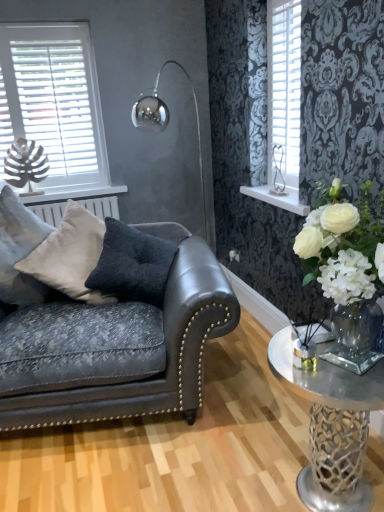
This screenshot has width=384, height=512. I want to click on white silk flower at center, so click(x=234, y=256).

At what (x,y) coordinates should I click in order to perform the action: click on white wood shelf at upper right. Please return your answer as a coordinate pair (x, y). The height and width of the screenshot is (512, 384). Looking at the image, I should click on pyautogui.click(x=278, y=198).

Find the location of `clear glass vase at right`. clear glass vase at right is located at coordinates (331, 426).

This screenshot has width=384, height=512. Describe the element at coordinates (331, 426) in the screenshot. I see `clear glass vase at right` at that location.

Describe the element at coordinates (19, 251) in the screenshot. I see `soft white fabric pillow at upper left, which appears as the 1th pillow when viewed from the left` at that location.

At what (x,y) coordinates should I click in order to perform the action: click on soft white fabric pillow at upper left, which appears as the 1th pillow when viewed from the left. Please return your answer as a coordinate pair (x, y). This screenshot has width=384, height=512. Looking at the image, I should click on (19, 251).

Find the location of `leather couch at left`. leather couch at left is located at coordinates (117, 347).

The image size is (384, 512). Find the location of `white silk flower at center`. white silk flower at center is located at coordinates (234, 256).

Is white wood shelf at upper right touching soft white fabric pillow at upper left, arranged as the third pillow when viewed from the right?

No, white wood shelf at upper right is not beside soft white fabric pillow at upper left, arranged as the third pillow when viewed from the right.

Is white wood shelf at upper right facing away from soft white fabric pillow at upper left, which appears as the 1th pillow when viewed from the left?

No, white wood shelf at upper right is not facing away from soft white fabric pillow at upper left, which appears as the 1th pillow when viewed from the left.

Based on the photo, which point is more distant from viewer, (x=276, y=201) or (x=1, y=291)?

Point (x=276, y=201)

Does white wood shelf at upper right have a greater height compared to soft white fabric pillow at upper left, which appears as the 1th pillow when viewed from the left?

No, white wood shelf at upper right is not taller than soft white fabric pillow at upper left, which appears as the 1th pillow when viewed from the left.

Considering the relative sizes of white plastic blinds at upper left and white wood shelf at upper right in the image provided, is white plastic blinds at upper left taller than white wood shelf at upper right?

Indeed, white plastic blinds at upper left has a greater height compared to white wood shelf at upper right.

Looking at this image, is white wood shelf at upper right at the back of white plastic blinds at upper left?

No.

Can you confirm if white plastic blinds at upper left is positioned to the left of white wood shelf at upper right?

Indeed, white plastic blinds at upper left is positioned on the left side of white wood shelf at upper right.

Between white plastic blinds at upper left and white wood shelf at upper right, which one has larger width?

white wood shelf at upper right.

Is the surface of white plastic blinds at upper left in direct contact with clear glass vase at lower right?

There is a gap between white plastic blinds at upper left and clear glass vase at lower right.

Based on the photo, choose the correct answer: Is white plastic blinds at upper left inside clear glass vase at lower right or outside it?

white plastic blinds at upper left is not inside clear glass vase at lower right, it's outside.

From a real-world perspective, is white plastic blinds at upper left positioned above or below clear glass vase at lower right?

white plastic blinds at upper left is above clear glass vase at lower right.

In the scene shown: Can you confirm if white plastic blinds at upper left is shorter than clear glass vase at lower right?

No.

Is silver metallic heart-shaped ornament at upper right placed right next to dark gray textured cushion at center, which ranks as the 3th pillow in left-to-right order?

No, silver metallic heart-shaped ornament at upper right is not beside dark gray textured cushion at center, which ranks as the 3th pillow in left-to-right order.

Can you confirm if silver metallic heart-shaped ornament at upper right is wider than dark gray textured cushion at center, the first pillow from the right?

In fact, silver metallic heart-shaped ornament at upper right might be narrower than dark gray textured cushion at center, the first pillow from the right.

Which object is positioned more to the left, silver metallic heart-shaped ornament at upper right or dark gray textured cushion at center, the first pillow from the right?

dark gray textured cushion at center, the first pillow from the right.

Is white plastic blinds at upper left taller than silver metallic heart-shaped ornament at upper right?

Correct, white plastic blinds at upper left is much taller as silver metallic heart-shaped ornament at upper right.

Considering the sizes of objects white plastic blinds at upper left and silver metallic heart-shaped ornament at upper right in the image provided, who is smaller, white plastic blinds at upper left or silver metallic heart-shaped ornament at upper right?

With smaller size is silver metallic heart-shaped ornament at upper right.

Is white plastic blinds at upper left outside of silver metallic heart-shaped ornament at upper right?

Yes, white plastic blinds at upper left is located beyond the bounds of silver metallic heart-shaped ornament at upper right.

From a real-world perspective, which object rests below the other?

From a 3D spatial view, silver metallic heart-shaped ornament at upper right is below.

Considering the relative sizes of leather couch at left and dark gray textured cushion at center, which ranks as the 3th pillow in left-to-right order, in the image provided, is leather couch at left shorter than dark gray textured cushion at center, which ranks as the 3th pillow in left-to-right order,?

No.

Is leather couch at left oriented away from dark gray textured cushion at center, the first pillow from the right?

No, leather couch at left is not facing away from dark gray textured cushion at center, the first pillow from the right.

Based on the photo, from the image's perspective, is leather couch at left on dark gray textured cushion at center, which ranks as the 3th pillow in left-to-right order?

No, from the image's perspective, leather couch at left is not over dark gray textured cushion at center, which ranks as the 3th pillow in left-to-right order.

Does leather couch at left have a smaller size compared to dark gray textured cushion at center, the first pillow from the right?

No.

Are clear glass vase at right and white wood shelf at upper right located far from each other?

Absolutely, clear glass vase at right is distant from white wood shelf at upper right.

How many degrees apart are the facing directions of clear glass vase at right and white wood shelf at upper right?

There is a 0.000219-degree angle between the facing directions of clear glass vase at right and white wood shelf at upper right.

Does clear glass vase at right turn towards white wood shelf at upper right?

No, clear glass vase at right is not aimed at white wood shelf at upper right.

Considering the relative sizes of clear glass vase at right and white wood shelf at upper right in the image provided, is clear glass vase at right smaller than white wood shelf at upper right?

No.

This screenshot has width=384, height=512. I want to click on window sill that appears on the right of soft white fabric pillow at upper left, which appears as the 1th pillow when viewed from the left, so click(x=278, y=198).

Where is `window sill in front of the white plastic blinds at upper left`? The height and width of the screenshot is (512, 384). window sill in front of the white plastic blinds at upper left is located at coordinates (278, 198).

Which object lies nearer to the anchor point dark gray textured cushion at center, which ranks as the 3th pillow in left-to-right order, clear glass vase at right or soft white fabric pillow at upper left, which appears as the 1th pillow when viewed from the left?

soft white fabric pillow at upper left, which appears as the 1th pillow when viewed from the left, is closer to dark gray textured cushion at center, which ranks as the 3th pillow in left-to-right order.

Considering their positions, is suede-like beige pillow at center, positioned as the second pillow in right-to-left order, positioned closer to white plastic blinds at upper left than white silk flower at center?

Among the two, suede-like beige pillow at center, positioned as the second pillow in right-to-left order, is located nearer to white plastic blinds at upper left.

Estimate the real-world distances between objects in this image. Which object is further from leather couch at left, clear glass vase at lower right or white silk flower at center?

Among the two, white silk flower at center is located further to leather couch at left.

Estimate the real-world distances between objects in this image. Which object is closer to soft white fabric pillow at upper left, arranged as the third pillow when viewed from the right, leather couch at left or suede-like beige pillow at center, the 2th pillow from the left?

suede-like beige pillow at center, the 2th pillow from the left, is closer to soft white fabric pillow at upper left, arranged as the third pillow when viewed from the right.

Estimate the real-world distances between objects in this image. Which object is closer to dark gray textured cushion at center, which ranks as the 3th pillow in left-to-right order, soft white fabric pillow at upper left, which appears as the 1th pillow when viewed from the left, or white silk flower at center?

Among the two, soft white fabric pillow at upper left, which appears as the 1th pillow when viewed from the left, is located nearer to dark gray textured cushion at center, which ranks as the 3th pillow in left-to-right order.

Consider the image. Based on their spatial positions, is dark gray textured cushion at center, the first pillow from the right, or white plastic shutter at upper right closer to white silk flower at center?

Among the two, dark gray textured cushion at center, the first pillow from the right, is located nearer to white silk flower at center.

When comparing their distances from suede-like beige pillow at center, positioned as the second pillow in right-to-left order, does dark gray textured cushion at center, the first pillow from the right, or white silk flower at center seem further?

white silk flower at center is positioned further to the anchor suede-like beige pillow at center, positioned as the second pillow in right-to-left order.

Which object lies nearer to the anchor point white plastic blinds at upper left, soft white fabric pillow at upper left, arranged as the third pillow when viewed from the right, or white wood shelf at upper right?

Among the two, soft white fabric pillow at upper left, arranged as the third pillow when viewed from the right, is located nearer to white plastic blinds at upper left.

Find the location of `window sill between white plastic shutter at upper right and clear glass vase at right from top to bottom`. window sill between white plastic shutter at upper right and clear glass vase at right from top to bottom is located at coordinates (278, 198).

This screenshot has height=512, width=384. Identify the location of vase between clear glass vase at right and white silk flower at center from front to back. (355, 333).

I want to click on coffee table between dark gray textured cushion at center, which ranks as the 3th pillow in left-to-right order, and clear glass vase at lower right from left to right, so click(x=331, y=426).

Locate an element on the screen. Image resolution: width=384 pixels, height=512 pixels. window sill between leather couch at left and white silk flower at center along the z-axis is located at coordinates (278, 198).